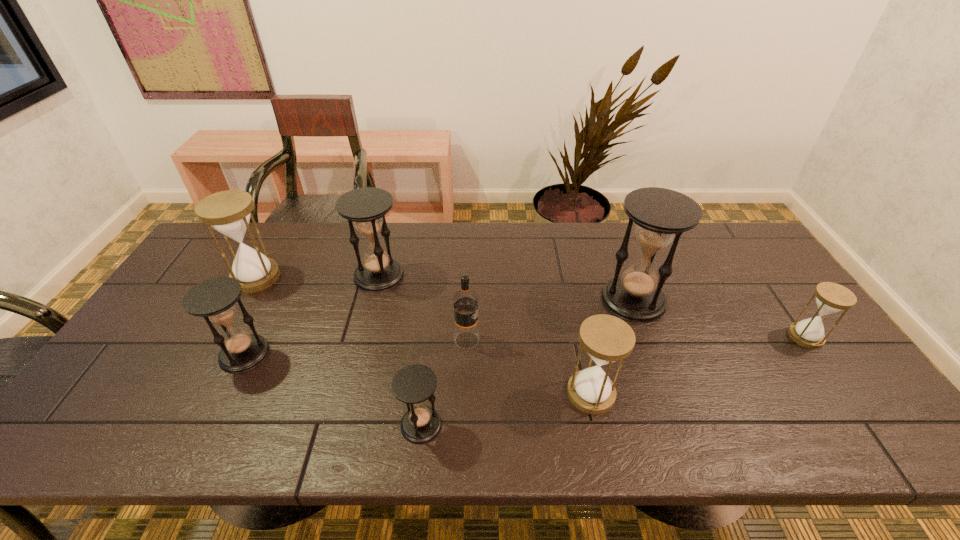
The height and width of the screenshot is (540, 960). Find the location of `free spot between the biggest white hourglass and the fourth object from right to left`. free spot between the biggest white hourglass and the fourth object from right to left is located at coordinates (362, 309).

Identify which object is the fourth closest to the farthest white hourglass. Please provide its 2D coordinates. Your answer should be formatted as a tuple, i.e. [(x, y)], where the tuple contains the x and y coordinates of a point satisfying the conditions above.

[(414, 384)]

What are the coordinates of `object that stands as the fourth closest to the fifth object from left to right` in the screenshot? It's located at (661, 215).

Locate which hourglass ranks seventh in proximity to the vodka. Please provide its 2D coordinates. Your answer should be formatted as a tuple, i.e. [(x, y)], where the tuple contains the x and y coordinates of a point satisfying the conditions above.

[(831, 298)]

Choose which hourglass is the fourth nearest neighbor to the second white hourglass from left to right. Please provide its 2D coordinates. Your answer should be formatted as a tuple, i.e. [(x, y)], where the tuple contains the x and y coordinates of a point satisfying the conditions above.

[(366, 207)]

Find the location of a particular element. black hourglass that stands as the second closest to the smallest white hourglass is located at coordinates (414, 384).

Find the location of a particular element. This screenshot has height=540, width=960. black hourglass that stands as the closest to the biggest white hourglass is located at coordinates (214, 299).

Where is `white hourglass that is the nearest to the biggest black hourglass`? This screenshot has width=960, height=540. white hourglass that is the nearest to the biggest black hourglass is located at coordinates (606, 338).

Locate an element on the screen. The width and height of the screenshot is (960, 540). the closest white hourglass to the fifth hourglass from left to right is located at coordinates (831, 298).

Where is `free space that satisfies the following two spatial constraints: 1. on the front side of the leftmost white hourglass; 2. on the left side of the second biggest white hourglass`? free space that satisfies the following two spatial constraints: 1. on the front side of the leftmost white hourglass; 2. on the left side of the second biggest white hourglass is located at coordinates (191, 393).